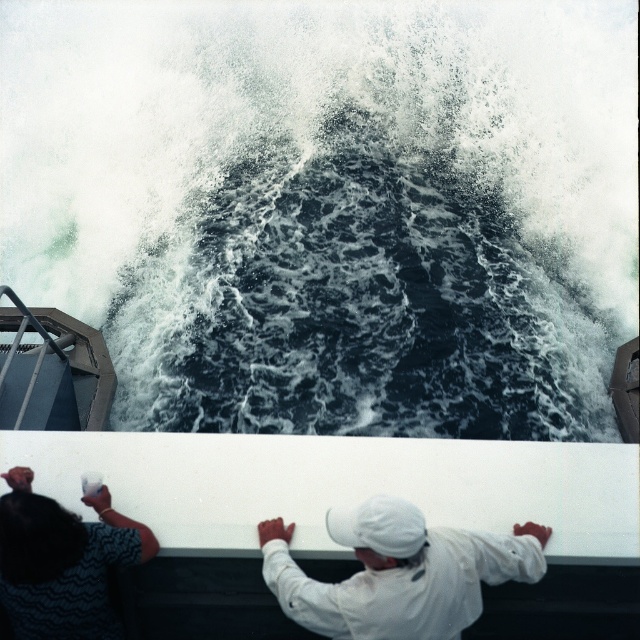
Question: Which object is the closest to the dark blue textured robe at lower left?

Choices:
 (A) white matte cap at center
 (B) dark blue water at center

Answer: (A)

Question: Can you confirm if dark blue water at center is thinner than white matte cap at center?

Choices:
 (A) no
 (B) yes

Answer: (A)

Question: Considering the relative positions of dark blue water at center and white matte cap at center in the image provided, where is dark blue water at center located with respect to white matte cap at center?

Choices:
 (A) above
 (B) below

Answer: (A)

Question: Which of the following is the closest to the observer?

Choices:
 (A) white matte cap at center
 (B) dark blue water at center
 (C) dark blue textured robe at lower left

Answer: (A)

Question: Is white matte cap at center to the left of dark blue textured robe at lower left from the viewer's perspective?

Choices:
 (A) yes
 (B) no

Answer: (B)

Question: Which point is closer to the camera?

Choices:
 (A) (467, 588)
 (B) (449, 166)
 (C) (118, 564)

Answer: (A)